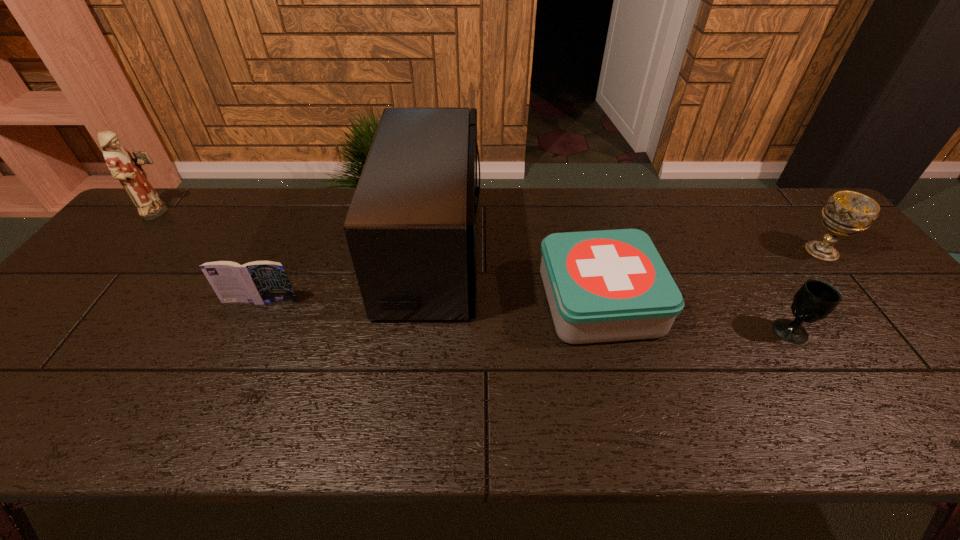
In order to click on the fourth object from right to left in this screenshot , I will do `click(411, 226)`.

At what (x,y) coordinates should I click in order to perform the action: click on figurine. Please return your answer as a coordinate pair (x, y). Looking at the image, I should click on click(x=128, y=170).

The width and height of the screenshot is (960, 540). Identify the location of the farther chalice. (846, 213).

Identify the location of the fourth shortest object. This screenshot has height=540, width=960. (846, 213).

At what (x,y) coordinates should I click in order to perform the action: click on the fifth object from left to right. Please return your answer as a coordinate pair (x, y). The width and height of the screenshot is (960, 540). Looking at the image, I should click on (816, 299).

What are the coordinates of `the shorter chalice` in the screenshot? It's located at [816, 299].

Image resolution: width=960 pixels, height=540 pixels. What are the coordinates of `the fifth object from right to left` in the screenshot? It's located at (259, 282).

At what (x,y) coordinates should I click in order to perform the action: click on the third object from right to left. Please return your answer as a coordinate pair (x, y). Looking at the image, I should click on (610, 285).

Identify the location of vacant point located 0.340m on the front-facing side of the third object from left to right. (599, 249).

Where is `blank area located on the front-facing side of the figurine`? The image size is (960, 540). blank area located on the front-facing side of the figurine is located at coordinates (296, 213).